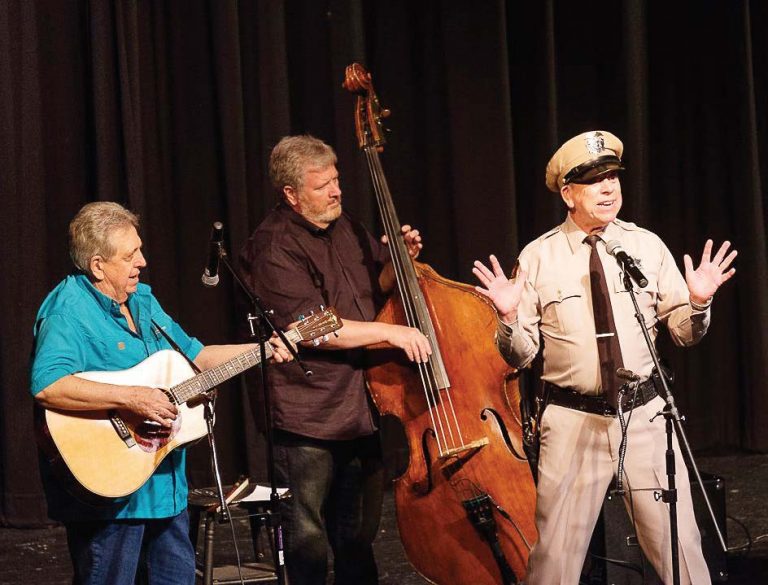
At what (x,y) coordinates should I click in order to perform the action: click on stool. Please return your answer as a coordinate pair (x, y). Image resolution: width=768 pixels, height=585 pixels. Looking at the image, I should click on [x=207, y=498].